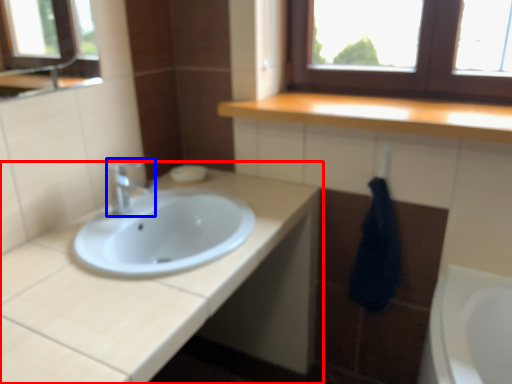
Question: Among these objects, which one is nearest to the camera, bathroom cabinet (highlighted by a red box) or tap (highlighted by a blue box)?

Choices:
 (A) bathroom cabinet
 (B) tap

Answer: (A)